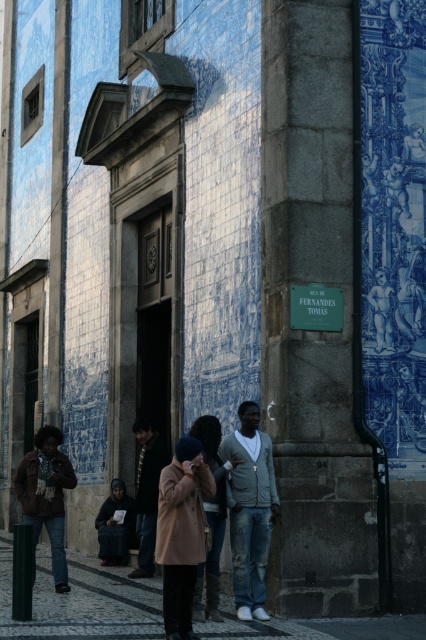
You are standing at the point marked by coordinates point (81, 602). Looking at the scene described, what surface are you currently standing on?

The surface you are standing on is the dark gray concrete sidewalk at lower center marked by point (81, 602).